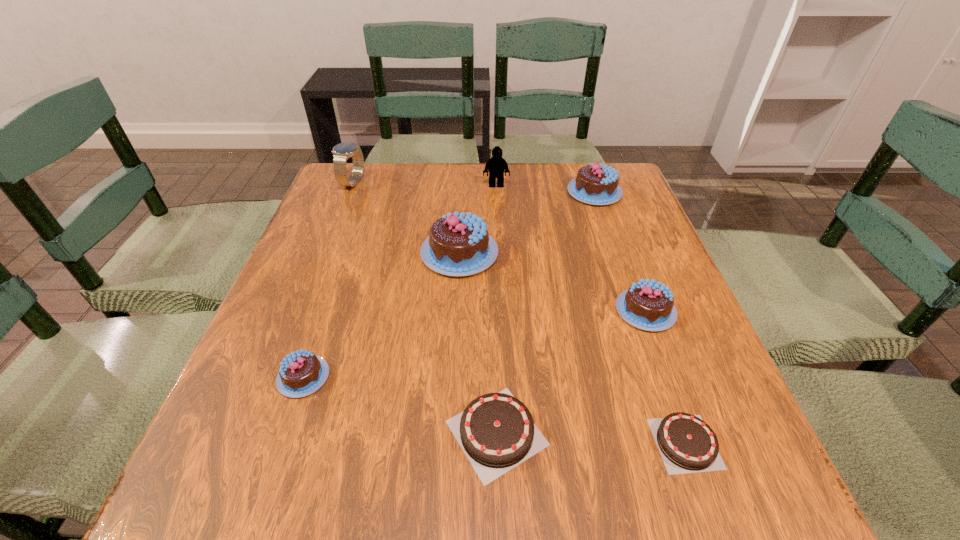
Where is `Lego`? The image size is (960, 540). Lego is located at coordinates (496, 166).

Find the location of a particular element. watch is located at coordinates (341, 152).

What are the coordinates of `the tallest chocolate cake` in the screenshot? It's located at (459, 244).

Where is `the fourth farthest object`? the fourth farthest object is located at coordinates (459, 244).

You are a GUI agent. You are given a task and a screenshot of the screen. Output one action in this format:
    pyautogui.click(x=<x>, y=<y>)
    Task: Click on the farthest pink chocolate cake
    This screenshot has height=540, width=960.
    Given the screenshot: What is the action you would take?
    pyautogui.click(x=597, y=184)

What are the coordinates of `the fifth shortest chocolate cake` in the screenshot? It's located at (597, 184).

Find the location of a particular element. This screenshot has height=540, width=960. the third biggest pink chocolate cake is located at coordinates (648, 305).

The height and width of the screenshot is (540, 960). Identify the location of the fifth farthest object. (648, 305).

Identify the location of the leftmost pink chocolate cake. The image size is (960, 540). (301, 373).

Where is `the smallest pink chocolate cake`? the smallest pink chocolate cake is located at coordinates (301, 373).